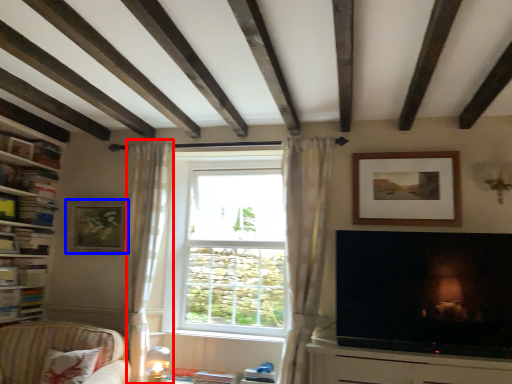
Question: Which of the following is the farthest to the observer, curtain (highlighted by a red box) or picture frame (highlighted by a blue box)?

Choices:
 (A) curtain
 (B) picture frame

Answer: (B)